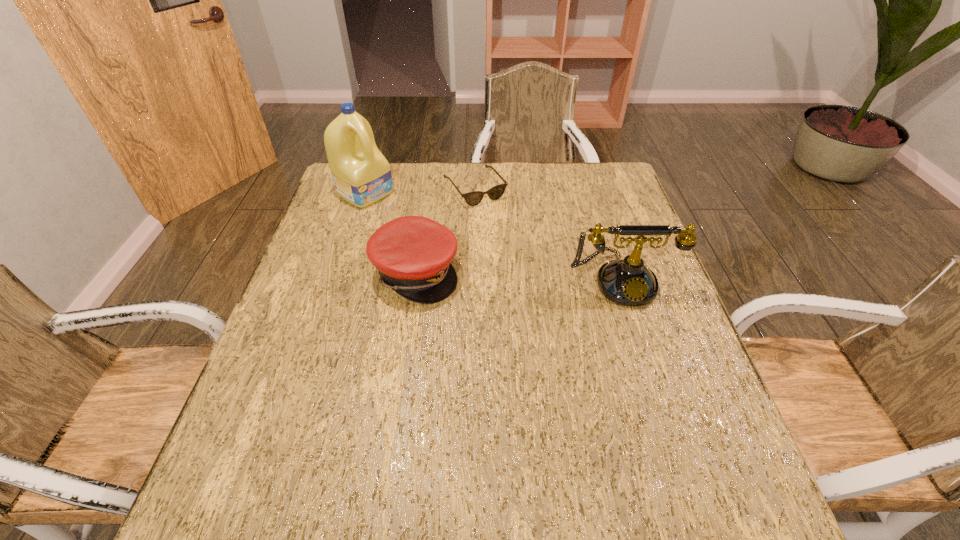
At what (x,y) coordinates should I click in order to perform the action: click on vacant space positioned 0.320m on the label of the tallest object. Please return your answer as a coordinate pair (x, y). Looking at the image, I should click on (460, 250).

The width and height of the screenshot is (960, 540). I want to click on vacant region located on the label of the tallest object, so (x=442, y=239).

The height and width of the screenshot is (540, 960). I want to click on vacant space situated 0.100m on the label of the tallest object, so 406,217.

Identify the location of sunglasses that is at the far edge. This screenshot has width=960, height=540. (473, 198).

Where is `detergent positioned at the far edge`? detergent positioned at the far edge is located at coordinates (362, 176).

The width and height of the screenshot is (960, 540). I want to click on object positioned at the left edge, so click(x=362, y=176).

Where is `object that is at the right edge`? The width and height of the screenshot is (960, 540). object that is at the right edge is located at coordinates (628, 282).

Where is `object present at the far left corner`? This screenshot has height=540, width=960. object present at the far left corner is located at coordinates (362, 176).

Identify the location of vacant space at the far edge. (486, 170).

At what (x,y) coordinates should I click in order to perform the action: click on free space at the near edge. Please return your answer as a coordinate pair (x, y). Looking at the image, I should click on (389, 435).